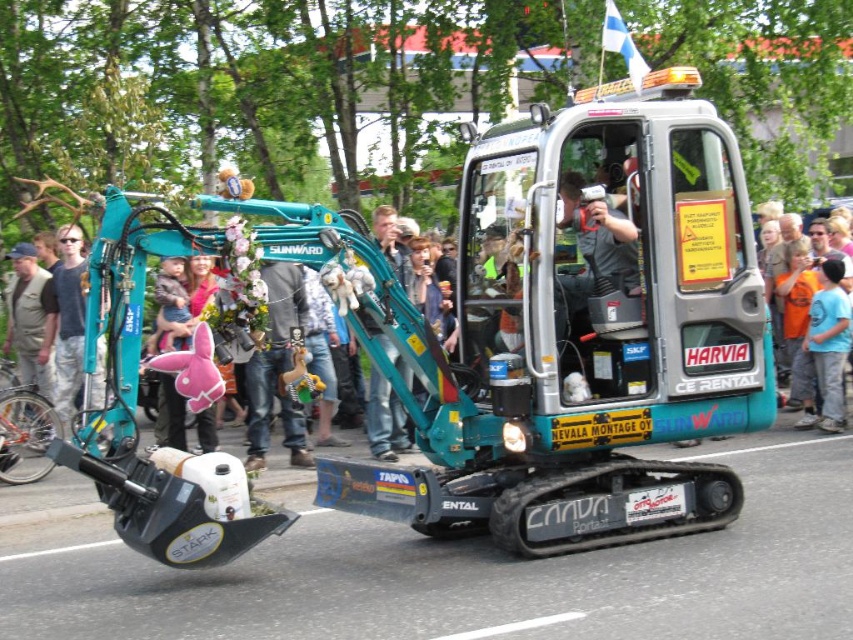
You are a spectator at the event and want to take a photo of the teal metallic excavator at center and the teal plastic excavator at center. Which one should you point your camera upwards to capture?

You should point your camera upwards to capture the teal metallic excavator at center because it is positioned above the teal plastic excavator at center.

You are a photographer standing behind the barriers at the parade. You want to capture a photo of the teal metallic excavator at center and the orange cotton shirt at right in the same frame. Considering their sizes, which object should you zoom in on to ensure both fit in the photo?

The teal metallic excavator at center is wider than the orange cotton shirt at right. To ensure both fit in the photo, you should zoom out slightly so that the wider teal metallic excavator at center is fully captured, allowing the orange cotton shirt at right to also be included in the frame.

You are a photographer at the parade and want to capture a photo of both the teal metallic excavator at center and the orange cotton shirt at right in the same frame. Considering their sizes, which object should you focus on to ensure both are visible?

Since the teal metallic excavator at center is much taller than the orange cotton shirt at right, you should focus on the teal metallic excavator at center to ensure both objects are visible in the frame.